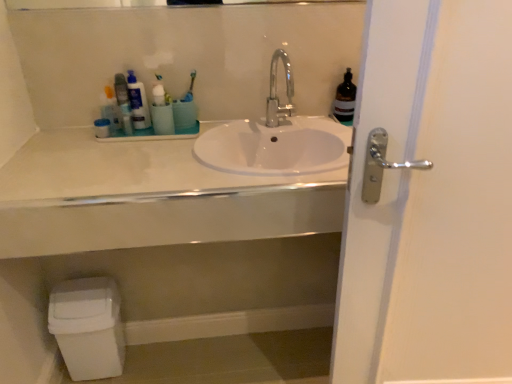
This screenshot has width=512, height=384. I want to click on vacant area located to the right-hand side of white plastic container at upper left, which is the 2th toiletry from right to left, so click(149, 138).